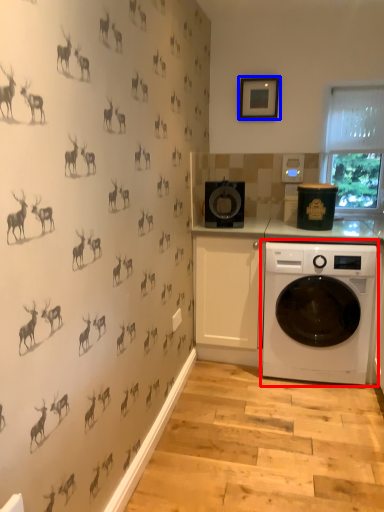
Question: Among these objects, which one is nearest to the camera, washing machine (highlighted by a red box) or picture frame (highlighted by a blue box)?

Choices:
 (A) washing machine
 (B) picture frame

Answer: (A)